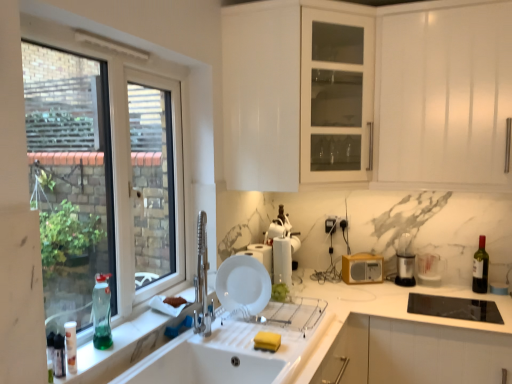
Locate an element on the screen. Image resolution: width=512 pixels, height=384 pixels. blank space situated above white plastic window at left (from a real-world perspective) is located at coordinates (104, 41).